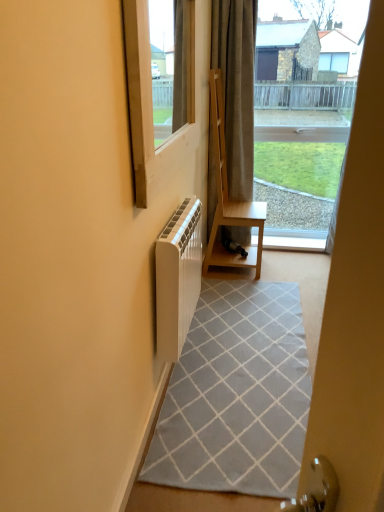
Describe the element at coordinates (236, 87) in the screenshot. I see `dark gray textured curtain at center` at that location.

Find the location of `transparent glass window at center`. transparent glass window at center is located at coordinates (305, 110).

Find the location of a particular element. white plastic window at upper left is located at coordinates (152, 104).

How different are the orientations of white plastic window at upper left and white matte radiator at left in degrees?

0.00091 degrees separate the facing orientations of white plastic window at upper left and white matte radiator at left.

Who is more distant, white plastic window at upper left or white matte radiator at left?

white matte radiator at left is further from the camera.

Does white plastic window at upper left turn towards white matte radiator at left?

No, white plastic window at upper left is not facing towards white matte radiator at left.

Locate an element on the screen. radiator on the right of white plastic window at upper left is located at coordinates (177, 278).

Does white wood at center have a lesser height compared to white matte radiator at left?

Indeed, white wood at center has a lesser height compared to white matte radiator at left.

From a real-world perspective, is white wood at center above or below white matte radiator at left?

white wood at center is below white matte radiator at left.

Would you say white wood at center is a long distance from white matte radiator at left?

Absolutely, white wood at center is distant from white matte radiator at left.

From a real-world perspective, which is physically below, white wood at center or transparent glass window at center?

In real-world perspective, white wood at center is lower.

Considering the relative sizes of white wood at center and transparent glass window at center in the image provided, is white wood at center taller than transparent glass window at center?

No.

Which object is further away from the camera, white wood at center or transparent glass window at center?

white wood at center is further from the camera.

Looking at this image, from a real-world perspective, does white plastic window at upper left stand above transparent glass window at center?

Indeed, from a real-world perspective, white plastic window at upper left stands above transparent glass window at center.

Does white plastic window at upper left have a lesser width compared to transparent glass window at center?

Correct, the width of white plastic window at upper left is less than that of transparent glass window at center.

At what (x,y) coordinates should I click in order to perform the action: click on bay window to the right of white plastic window at upper left. Please return your answer as a coordinate pair (x, y). Looking at the image, I should click on (305, 110).

Which object is further away from the camera taking this photo, white matte radiator at left or dark gray textured curtain at center?

dark gray textured curtain at center is more distant.

What's the angular difference between white matte radiator at left and dark gray textured curtain at center's facing directions?

They differ by 87.4 degrees in their facing directions.

Is point (159, 240) closer to viewer compared to point (214, 35)?

Yes, point (159, 240) is in front of point (214, 35).

Looking at their sizes, would you say white matte radiator at left is wider or thinner than dark gray textured curtain at center?

Considering their sizes, white matte radiator at left looks slimmer than dark gray textured curtain at center.

Does gray woven rug at center have a lesser height compared to white plastic window at upper left?

Correct, gray woven rug at center is not as tall as white plastic window at upper left.

From a real-world perspective, between gray woven rug at center and white plastic window at upper left, who is vertically lower?

From a 3D spatial view, gray woven rug at center is below.

Which object is thinner, gray woven rug at center or white plastic window at upper left?

Thinner between the two is white plastic window at upper left.

Would you consider gray woven rug at center to be distant from white plastic window at upper left?

Absolutely, gray woven rug at center is distant from white plastic window at upper left.

Which of these two, dark gray textured curtain at center or white plastic window at upper left, is thinner?

white plastic window at upper left is thinner.

Considering their positions, is dark gray textured curtain at center located in front of or behind white plastic window at upper left?

dark gray textured curtain at center is behind white plastic window at upper left.

From the image's perspective, which one is positioned higher, dark gray textured curtain at center or white plastic window at upper left?

dark gray textured curtain at center is shown above in the image.

Is dark gray textured curtain at center oriented towards white plastic window at upper left?

Yes, dark gray textured curtain at center faces towards white plastic window at upper left.

At what (x,y) coordinates should I click in order to perform the action: click on window that appears in front of the white matte radiator at left. Please return your answer as a coordinate pair (x, y). Looking at the image, I should click on (152, 104).

At what (x,y) coordinates should I click in order to perform the action: click on window sill that appears below the white matte radiator at left (from a real-world perspective). Please return your answer as a coordinate pair (x, y). This screenshot has width=384, height=512. Looking at the image, I should click on (294, 240).

When comparing their distances from gray woven rug at center, does white wood at center or transparent glass window at center seem further?

transparent glass window at center lies further to gray woven rug at center than the other object.

Looking at the image, which one is located further to white matte radiator at left, light brown wood shelf at center or white wood at center?

white wood at center.

Based on their spatial positions, is transparent glass window at center or dark gray textured curtain at center further from white matte radiator at left?

The object further to white matte radiator at left is transparent glass window at center.

Looking at this image, looking at the image, which one is located closer to white wood at center, white plastic window at upper left or light brown wood shelf at center?

light brown wood shelf at center is positioned closer to the anchor white wood at center.

Considering their positions, is white wood at center positioned closer to gray woven rug at center than light brown wood shelf at center?

light brown wood shelf at center.

Which object lies further to the anchor point white matte radiator at left, white plastic window at upper left or white wood at center?

The object further to white matte radiator at left is white wood at center.

Considering their positions, is white matte radiator at left positioned further to white wood at center than light brown wood shelf at center?

white matte radiator at left is further to white wood at center.

Which object lies further to the anchor point white matte radiator at left, light brown wood shelf at center or transparent glass window at center?

The object further to white matte radiator at left is transparent glass window at center.

The height and width of the screenshot is (512, 384). In order to click on curtain positioned between white plastic window at upper left and white wood at center from near to far in this screenshot , I will do `click(236, 87)`.

Where is `radiator between transparent glass window at center and gray woven rug at center from top to bottom`? The image size is (384, 512). radiator between transparent glass window at center and gray woven rug at center from top to bottom is located at coordinates (177, 278).

Identify the location of bay window positioned between gray woven rug at center and white wood at center from near to far. The width and height of the screenshot is (384, 512). (305, 110).

I want to click on furniture located between white matte radiator at left and transparent glass window at center in the depth direction, so [228, 196].